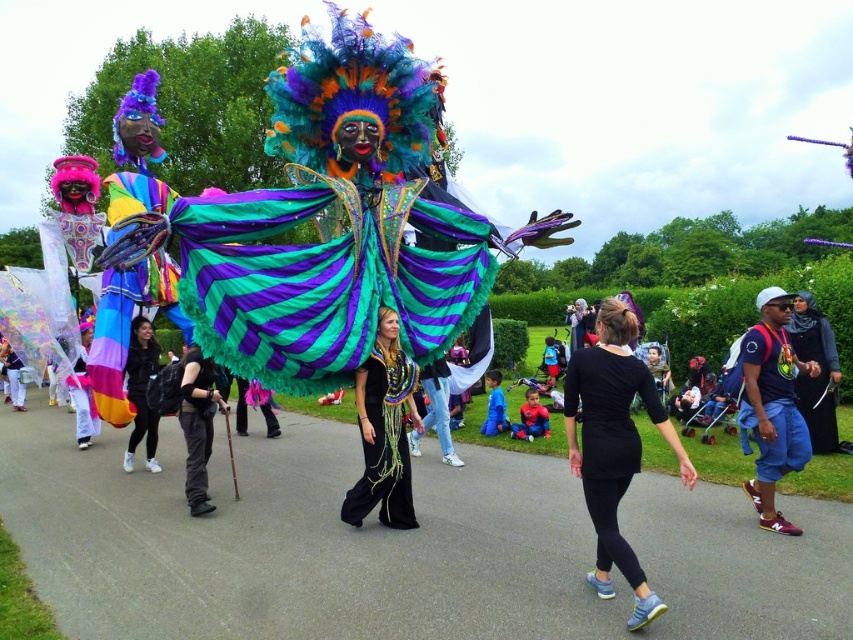
You are standing at the origin point in the scene. Can you determine the direction of the black matte leggings at lower center based on its coordinates?

The black matte leggings at lower center is located at point 0.698 in the x and 0.721 in the y coordinates, which means it is positioned to the right and slightly below the center of the scene.

You are attending a masquerade ball and notice two attendees wearing the black velvet dress at center and the matte black leggings at center. Which outfit is longer?

The black velvet dress at center is taller than matte black leggings at center, so the black velvet dress at center is longer.